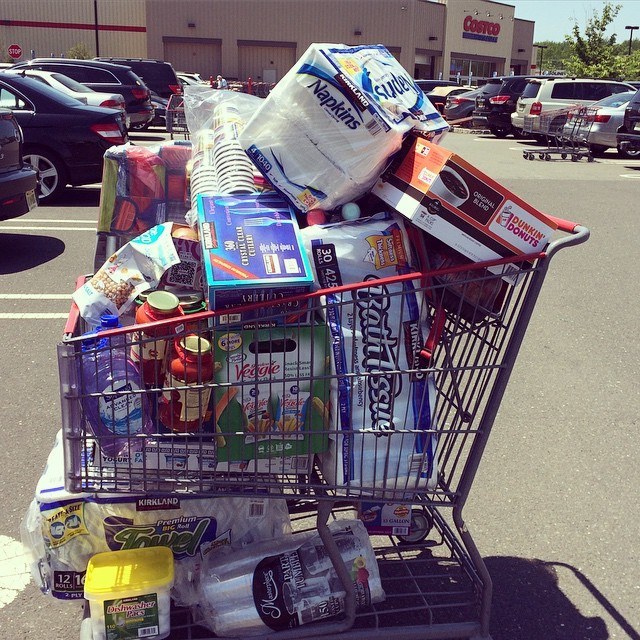
Find the location of `paper towels`. paper towels is located at coordinates (x=166, y=524).